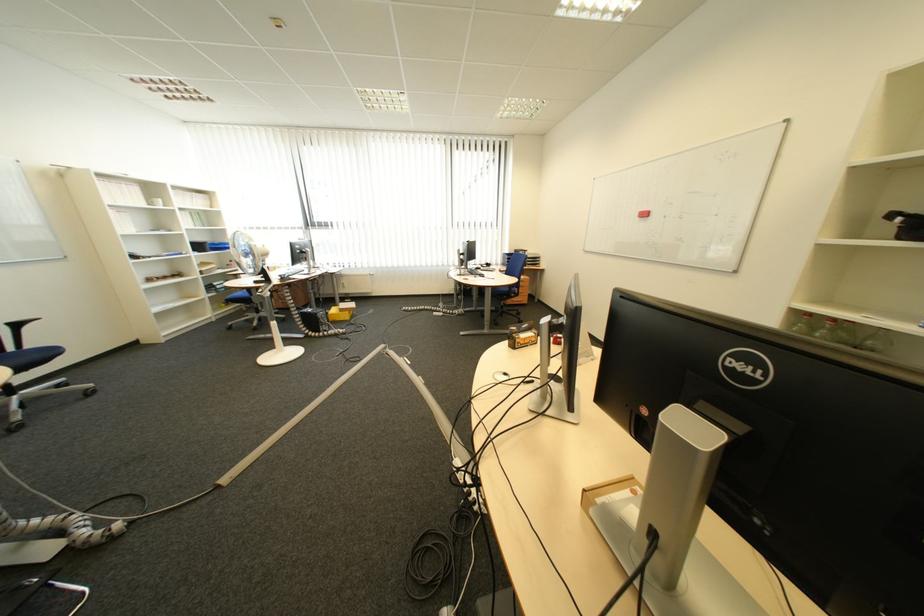
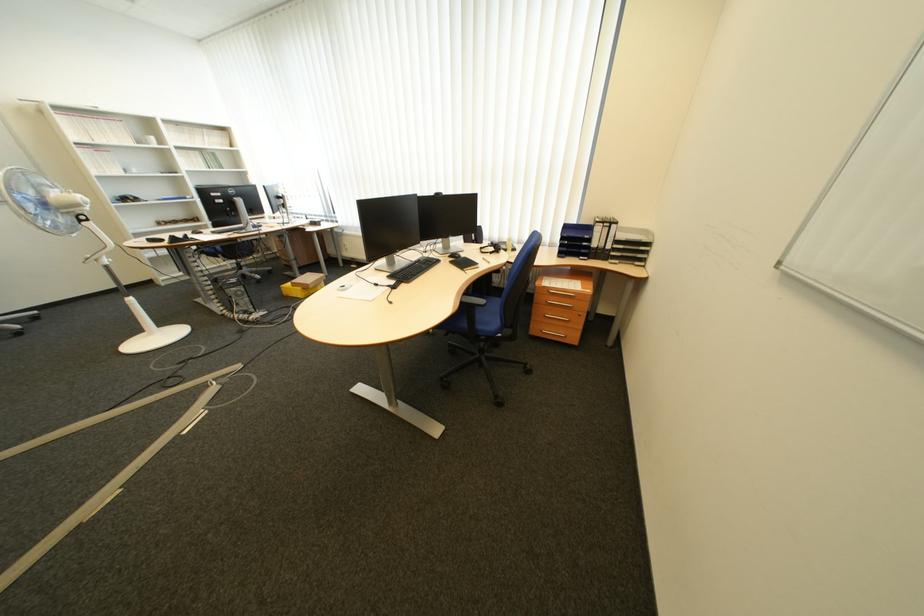
The point at [360,313] is marked in the first image. Where is the corresponding point in the second image?

(313, 290)